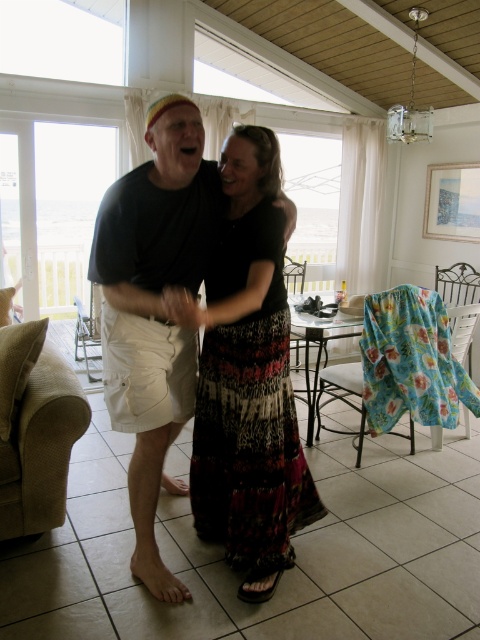
Based on the coordinates provided, can you identify which object corresponds to the point at (250, 410)?

The point at (250, 410) corresponds to the printed fabric dress at center.